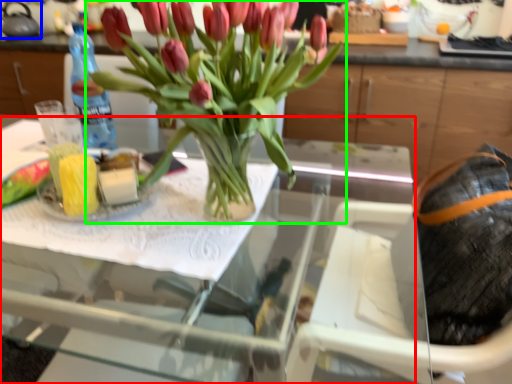
Question: Estimate the real-world distances between objects in this image. Which object is closer to table (highlighted by a red box), kettle (highlighted by a blue box) or houseplant (highlighted by a green box)?

Choices:
 (A) kettle
 (B) houseplant

Answer: (B)